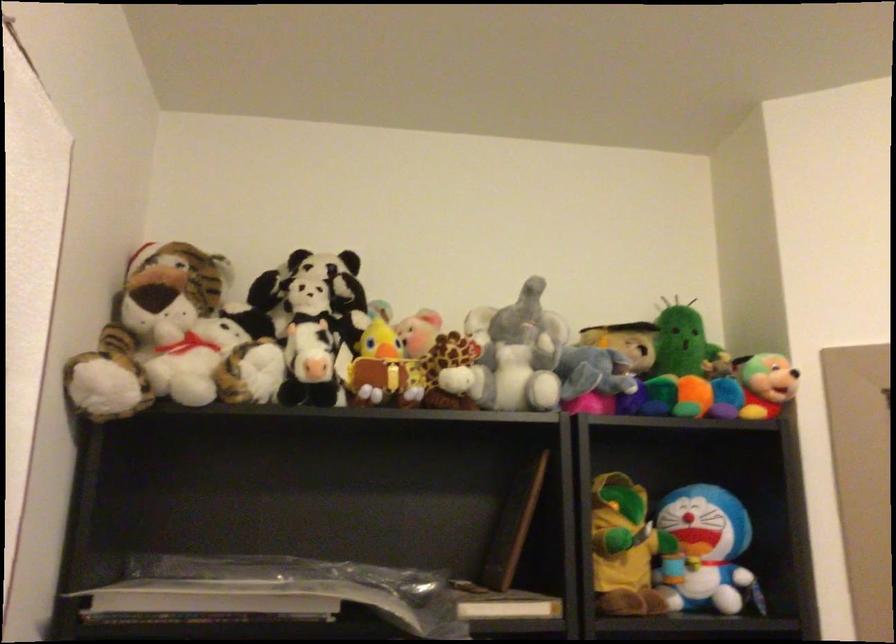
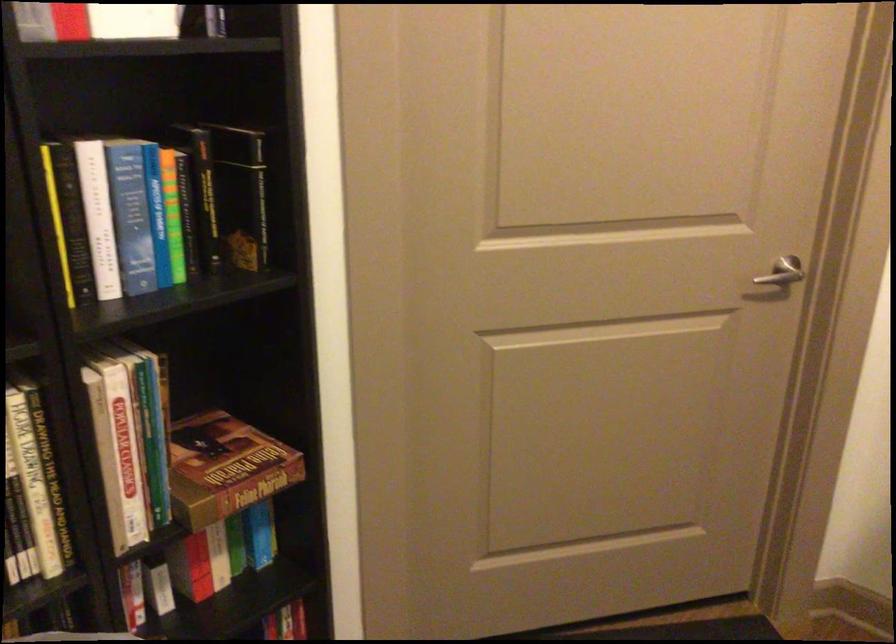
First-person continuous shooting, in which direction is the camera rotating?

The rotation direction of the camera is right-down.